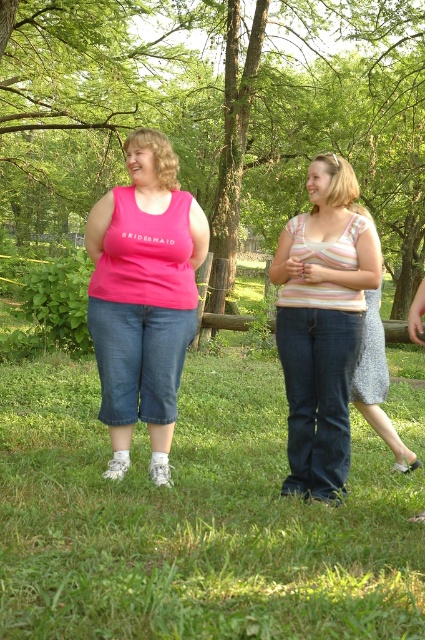
You are a photographer setting up for a photoshoot in a park. You have two outfits to choose from for the model. The first is the striped cotton tank top at center, and the second is the speckled fabric dress at center. Based on the description, which outfit would you recommend if you want the model to appear taller in the photo?

A: The striped cotton tank top at center has a greater height compared to the speckled fabric dress at center, so choosing the striped cotton tank top at center would make the model appear taller.

You are a photographer setting up a wide shot for a photoshoot. You need to ensure both the matte pink tank top at center and the speckled fabric dress at center are fully visible in the frame. Considering their sizes, which clothing item might require you to adjust your camera angle to prevent it from being cut off?

The matte pink tank top at center has a larger width than the speckled fabric dress at center, so it might require adjusting the camera angle to ensure it fits entirely within the frame.

You are a photographer setting up for a photoshoot in a park. You have two models wearing the matte pink tank top at center and the striped cotton tank top at center. Which model should you position closer to the camera to ensure both tops appear the same size in the photo?

To make both the matte pink tank top at center and the striped cotton tank top at center appear the same size in the photo, position the striped cotton tank top at center closer to the camera since it is smaller in size than the matte pink tank top at center.